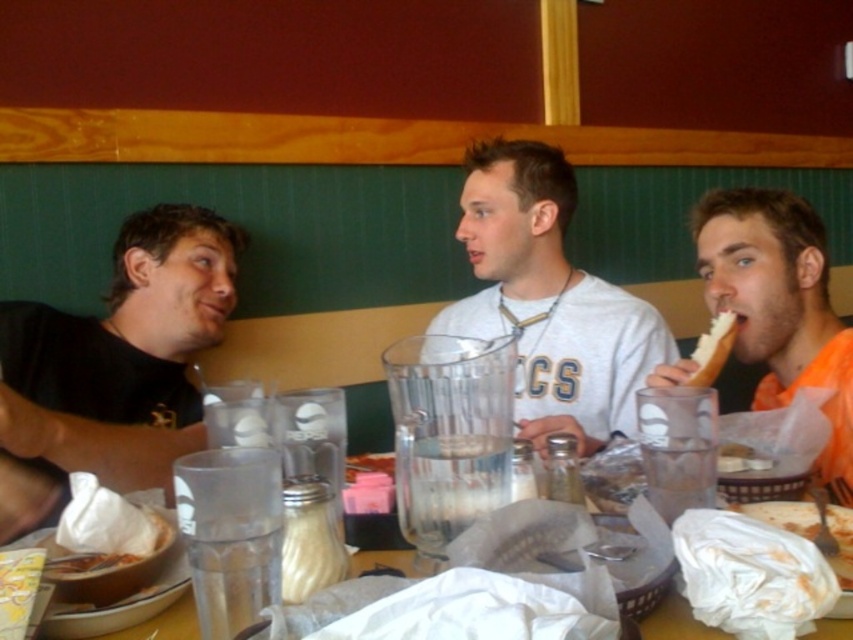
Between white paper sandwich at center and clear plastic cups at center, which one has more height?

With more height is clear plastic cups at center.

Is white paper sandwich at center shorter than clear plastic cups at center?

Yes, white paper sandwich at center is shorter than clear plastic cups at center.

Which is in front, point (816, 531) or point (109, 628)?

Positioned in front is point (109, 628).

Locate an element on the screen. This screenshot has height=640, width=853. white paper sandwich at center is located at coordinates (784, 515).

Is white matte shirt at center thinner than white bread at right?

No, white matte shirt at center is not thinner than white bread at right.

Can you confirm if white matte shirt at center is taller than white bread at right?

Yes.

Between point (544, 417) and point (711, 358), which one is positioned in front?

Point (711, 358)

Where is `white matte shirt at center`? white matte shirt at center is located at coordinates (549, 300).

Is matte black shirt at left wider than white matte shirt at center?

Incorrect, matte black shirt at left's width does not surpass white matte shirt at center's.

Which is behind, point (16, 500) or point (486, 230)?

Point (486, 230)

At what (x,y) coordinates should I click in order to perform the action: click on matte black shirt at left. Please return your answer as a coordinate pair (x, y). Looking at the image, I should click on (114, 365).